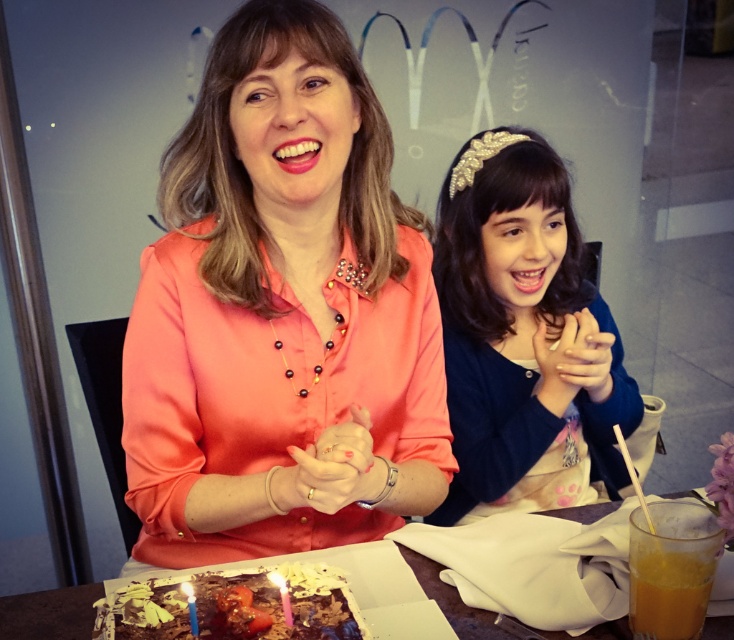
Question: Which is farther from the matte gold headband at center?

Choices:
 (A) blue wax candle at lower left
 (B) chocolatesmoothcake at lower center
 (C) matte yellow candle at lower left

Answer: (A)

Question: Which of the following is the farthest from the observer?

Choices:
 (A) matte coral blouse at center
 (B) matte yellow candle at lower left
 (C) blue wax candle at lower left
 (D) matte gold headband at center

Answer: (D)

Question: Estimate the real-world distances between objects in this image. Which object is farther from the matte gold headband at center?

Choices:
 (A) chocolate cake at lower center
 (B) blue wax candle at lower left
 (C) matte yellow candle at lower left
 (D) chocolatesmoothcake at lower center

Answer: (B)

Question: Does matte gold headband at center lie behind chocolate cake at lower center?

Choices:
 (A) no
 (B) yes

Answer: (B)

Question: Is matte gold headband at center above matte yellow candle at lower left?

Choices:
 (A) yes
 (B) no

Answer: (A)

Question: Can you confirm if matte gold headband at center is positioned above blue wax candle at lower left?

Choices:
 (A) yes
 (B) no

Answer: (A)